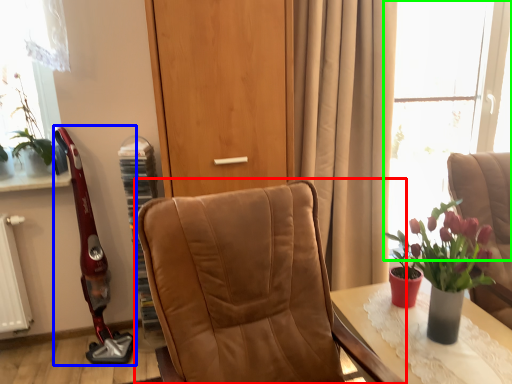
Question: Based on their relative distances, which object is nearer to chair (highlighted by a red box)? Choose from open (highlighted by a blue box) and window (highlighted by a green box).

Choices:
 (A) open
 (B) window

Answer: (A)